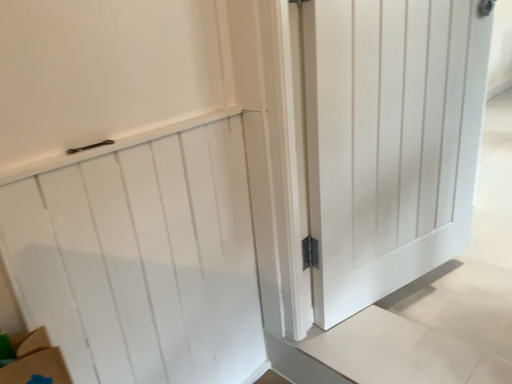
Question: Which direction should I rotate to look at white wood door at center, marked as the first door in a right-to-left arrangement, — up or down?

Choices:
 (A) up
 (B) down

Answer: (A)

Question: Can you confirm if white wood door at center, which ranks as the 2th door in left-to-right order, is positioned to the left of white wood door at upper left, which is the 1th door from left to right?

Choices:
 (A) yes
 (B) no

Answer: (B)

Question: Can you confirm if white wood door at center, which ranks as the 2th door in left-to-right order, is thinner than white wood door at upper left, which is the 1th door from left to right?

Choices:
 (A) no
 (B) yes

Answer: (A)

Question: Is white wood door at center, which ranks as the 2th door in left-to-right order, bigger than white wood door at upper left, which is the 1th door from left to right?

Choices:
 (A) yes
 (B) no

Answer: (A)

Question: Is white wood door at center, which ranks as the 2th door in left-to-right order, closer to camera compared to white wood door at upper left, positioned as the second door in right-to-left order?

Choices:
 (A) yes
 (B) no

Answer: (B)

Question: Is white wood door at center, marked as the first door in a right-to-left arrangement, taller than white wood door at upper left, positioned as the second door in right-to-left order?

Choices:
 (A) no
 (B) yes

Answer: (B)

Question: Is white wood door at center, which ranks as the 2th door in left-to-right order, to the right of white wood door at upper left, which is the 1th door from left to right, from the viewer's perspective?

Choices:
 (A) yes
 (B) no

Answer: (A)

Question: Does white wood door at upper left, which is the 1th door from left to right, have a greater height compared to white wood door at center, marked as the first door in a right-to-left arrangement?

Choices:
 (A) no
 (B) yes

Answer: (A)

Question: Considering the relative sizes of white wood door at upper left, positioned as the second door in right-to-left order, and white wood door at center, marked as the first door in a right-to-left arrangement, in the image provided, is white wood door at upper left, positioned as the second door in right-to-left order, smaller than white wood door at center, marked as the first door in a right-to-left arrangement,?

Choices:
 (A) no
 (B) yes

Answer: (B)

Question: Considering the relative sizes of white wood door at upper left, positioned as the second door in right-to-left order, and white wood door at center, which ranks as the 2th door in left-to-right order, in the image provided, is white wood door at upper left, positioned as the second door in right-to-left order, wider than white wood door at center, which ranks as the 2th door in left-to-right order,?

Choices:
 (A) no
 (B) yes

Answer: (A)

Question: Is white wood door at upper left, positioned as the second door in right-to-left order, turned away from white wood door at center, which ranks as the 2th door in left-to-right order?

Choices:
 (A) yes
 (B) no

Answer: (B)

Question: Can you confirm if white wood door at upper left, which is the 1th door from left to right, is bigger than white wood door at center, which ranks as the 2th door in left-to-right order?

Choices:
 (A) no
 (B) yes

Answer: (A)

Question: Could you tell me if white wood door at upper left, positioned as the second door in right-to-left order, is facing white wood door at center, marked as the first door in a right-to-left arrangement?

Choices:
 (A) yes
 (B) no

Answer: (B)

Question: Do you think white wood door at center, marked as the first door in a right-to-left arrangement, is within white wood door at upper left, positioned as the second door in right-to-left order, or outside of it?

Choices:
 (A) inside
 (B) outside

Answer: (B)